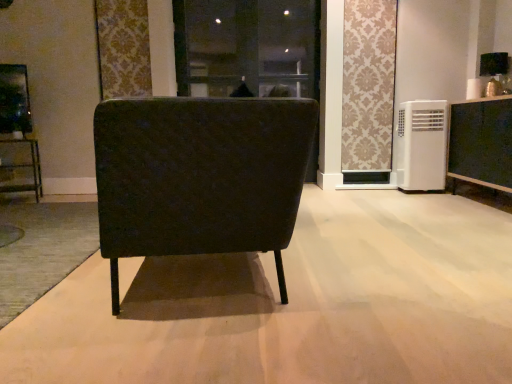
Question: Considering the positions of matte black chair at center and patterned fabric curtain at upper center in the image, is matte black chair at center wider or thinner than patterned fabric curtain at upper center?

Choices:
 (A) wide
 (B) thin

Answer: (A)

Question: Considering the positions of point (236, 132) and point (381, 79), is point (236, 132) closer or farther from the camera than point (381, 79)?

Choices:
 (A) farther
 (B) closer

Answer: (B)

Question: Considering the real-world distances, which object is farthest from the metallic silver shelf at left?

Choices:
 (A) matte black chair at center
 (B) white plastic air conditioner at right
 (C) black fabric screen door at center
 (D) patterned fabric curtain at upper center
 (E) matte black cabinet at right

Answer: (E)

Question: Based on their relative distances, which object is nearer to the matte black chair at center?

Choices:
 (A) patterned fabric curtain at upper center
 (B) white plastic air conditioner at right
 (C) black fabric screen door at center
 (D) matte black cabinet at right
 (E) metallic silver shelf at left

Answer: (D)